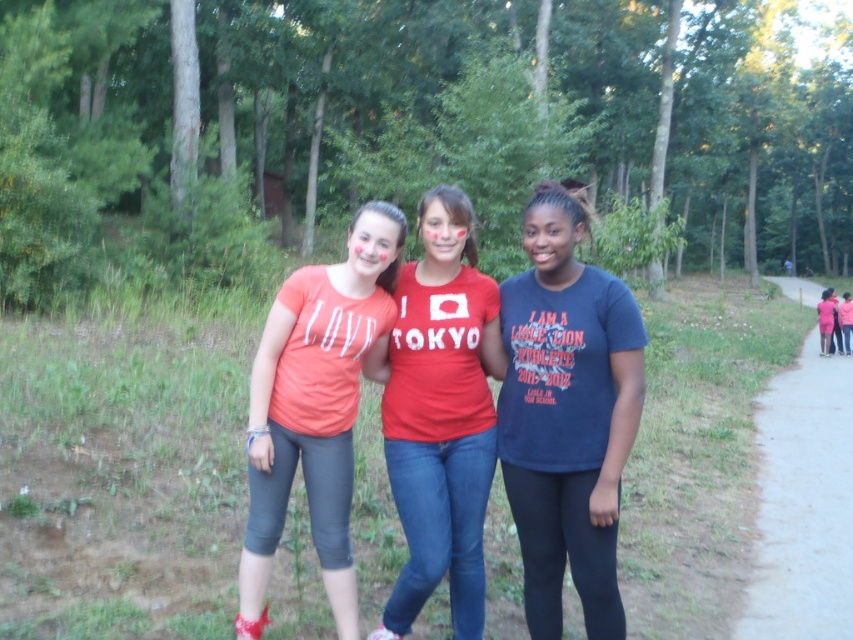
Who is positioned more to the right, matte red t-shirt at center or gray asphalt path at right?

Positioned to the right is gray asphalt path at right.

Can you confirm if matte red t-shirt at center is positioned to the left of gray asphalt path at right?

Yes, matte red t-shirt at center is to the left of gray asphalt path at right.

Which is in front, point (428, 592) or point (805, 346)?

Point (428, 592)

This screenshot has width=853, height=640. In order to click on matte red t-shirt at center in this screenshot , I will do `click(440, 417)`.

Can you confirm if dark blue t-shirt at center is positioned to the left of gray asphalt path at right?

Yes, dark blue t-shirt at center is to the left of gray asphalt path at right.

Does dark blue t-shirt at center have a lesser height compared to gray asphalt path at right?

In fact, dark blue t-shirt at center may be taller than gray asphalt path at right.

Between point (540, 212) and point (785, 566), which one is positioned in front?

Point (540, 212) is in front.

Where is `dark blue t-shirt at center`? dark blue t-shirt at center is located at coordinates (567, 413).

Where is `dark blue t-shirt at center`? The image size is (853, 640). dark blue t-shirt at center is located at coordinates (567, 413).

Between point (595, 524) and point (437, 292), which one is positioned behind?

The point (437, 292) is more distant.

Is point (579, 214) less distant than point (433, 413)?

Yes, point (579, 214) is closer to viewer.

This screenshot has height=640, width=853. I want to click on dark blue t-shirt at center, so click(x=567, y=413).